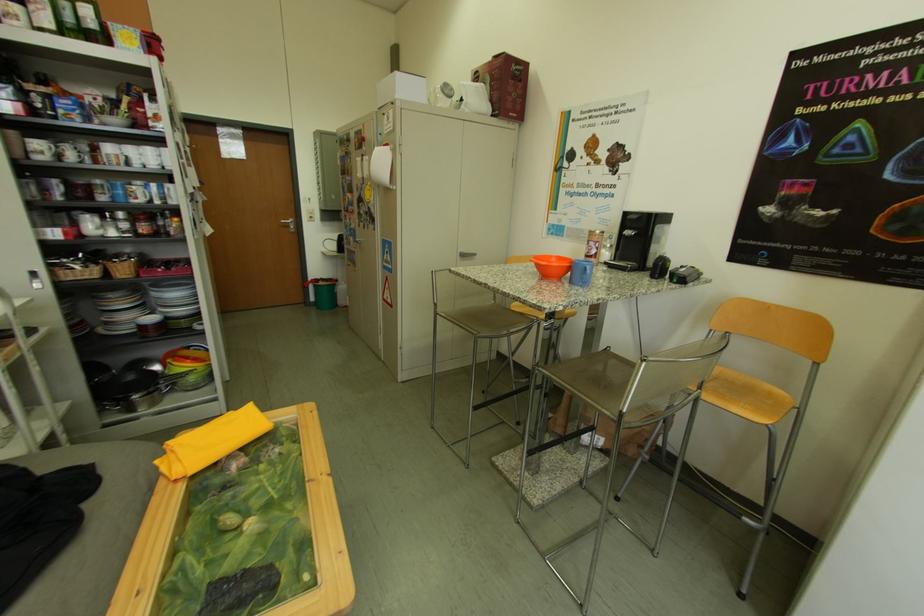
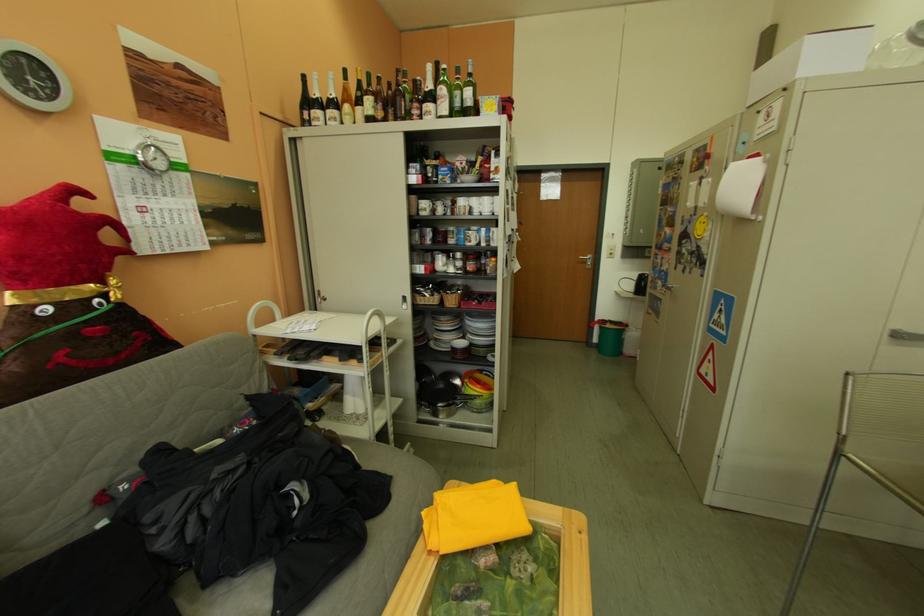
In the second image, find the point that corresponds to (x=164, y=322) in the first image.

(473, 346)